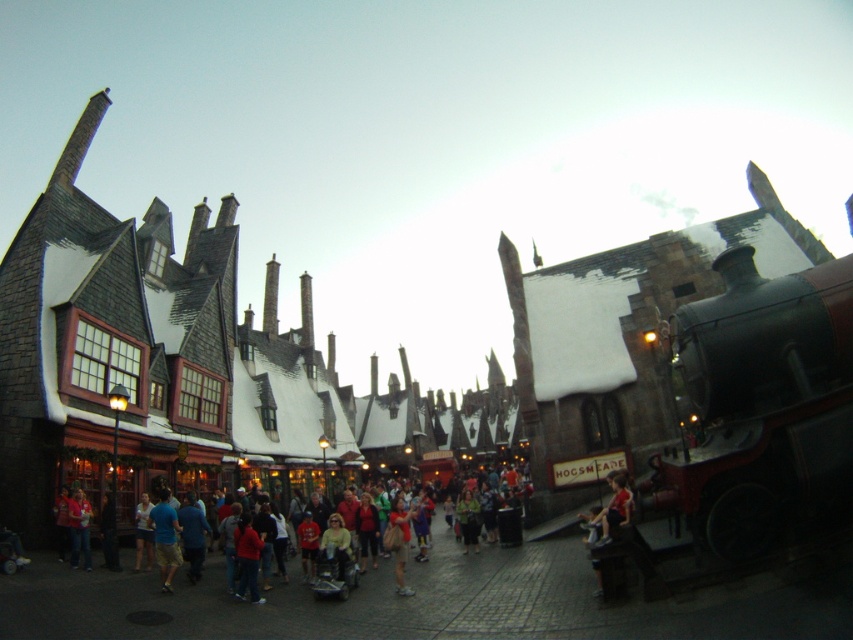
You are a wizard in Hogsmeade and need to quickly grab your blue cotton shorts at center and matte beige shirt at center from your bag. Which item is on the left side when you look at them?

The blue cotton shorts at center is positioned on the left side of the matte beige shirt at center.

You are a costume designer preparing for a Harry Potter themed event. You have two items to place on a mannequin in the Hogsmeade themed area shown in the image. The items are the blue cotton shorts at center and the matte beige shirt at center. Which item should be placed lower on the mannequin to ensure proper alignment with their positions in the image?

The matte beige shirt at center should be placed lower on the mannequin because the blue cotton shorts at center has a greater height compared to matte beige shirt at center, meaning the shorts are taller and should be positioned higher up.

You are standing in the middle of the Hogsmeade village street. There are two points marked on the ground in front of you. One is at coordinates point (163, 545) and the other is at point (398, 557). Which point is closer to you?

Point (163, 545) is closer to the camera than point (398, 557).